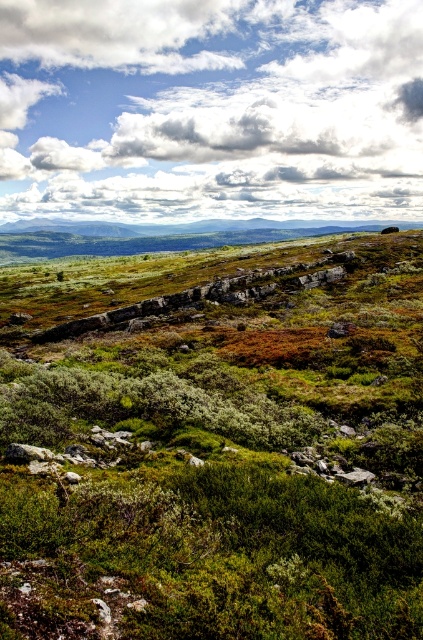
Question: Which object appears farthest from the camera in this image?

Choices:
 (A) green grassy field at center
 (B) white fluffy cloud at upper center

Answer: (B)

Question: Is green grassy field at center further to the viewer compared to white fluffy cloud at upper center?

Choices:
 (A) yes
 (B) no

Answer: (B)

Question: Which point is closer to the camera taking this photo?

Choices:
 (A) (283, 636)
 (B) (249, 72)

Answer: (A)

Question: Is green grassy field at center below white fluffy cloud at upper center?

Choices:
 (A) yes
 (B) no

Answer: (A)

Question: Does green grassy field at center have a lesser width compared to white fluffy cloud at upper center?

Choices:
 (A) yes
 (B) no

Answer: (A)